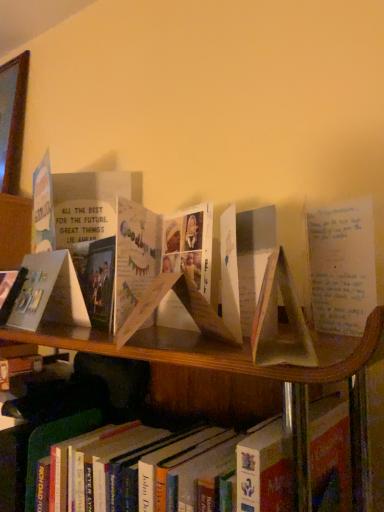
Question: Would you say matte paper card at left, the 2th paperback book viewed from the front, is inside or outside hardcover book at lower center?

Choices:
 (A) inside
 (B) outside

Answer: (B)

Question: From the image's perspective, is matte paper card at left, which is the first paperback book from left to right, above or below hardcover book at lower center?

Choices:
 (A) above
 (B) below

Answer: (A)

Question: Which of these objects is positioned closest to the matte paper book at center, positioned as the 1th paperback book in front-to-back order?

Choices:
 (A) hardcover book at lower center
 (B) matte paper card at left, acting as the first paperback book starting from the back

Answer: (A)

Question: Which object is the closest to the hardcover book at lower center?

Choices:
 (A) matte paper book at center, which is the first paperback book in right-to-left order
 (B) matte paper card at left, which is the first paperback book from left to right

Answer: (A)